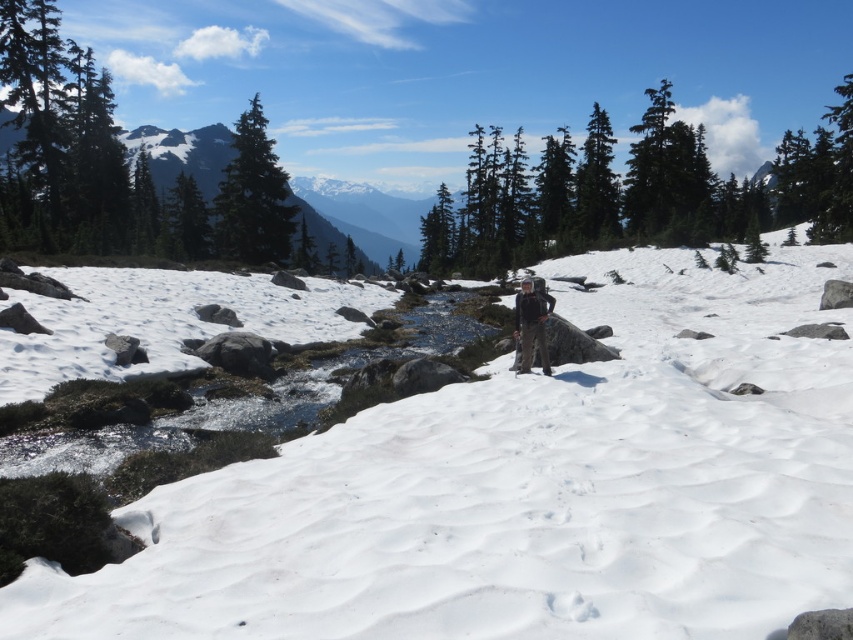
Question: Is snowy granite mountain at upper left thinner than green matte pine at upper left?

Choices:
 (A) yes
 (B) no

Answer: (B)

Question: Is snowy granite mountain at upper left thinner than green matte pine at upper left?

Choices:
 (A) yes
 (B) no

Answer: (B)

Question: Which object is positioned closest to the matte black backpack at center?

Choices:
 (A) snowy granite mountain at upper left
 (B) white fluffy snow at center

Answer: (B)

Question: Which of the following is the farthest from the observer?

Choices:
 (A) (231, 234)
 (B) (520, 330)

Answer: (A)

Question: Can you confirm if white fluffy snow at center is thinner than green matte pine at upper left?

Choices:
 (A) yes
 (B) no

Answer: (A)

Question: Which object appears farthest from the camera in this image?

Choices:
 (A) white fluffy snow at center
 (B) snowy granite mountain at upper left
 (C) green matte pine at upper left
 (D) matte black backpack at center

Answer: (B)